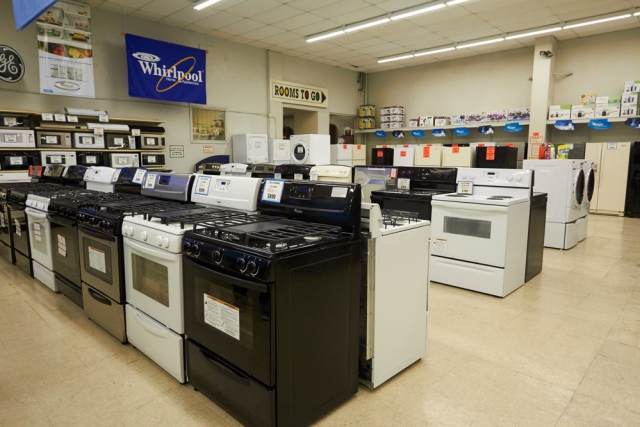
Locate an element on the screen. The width and height of the screenshot is (640, 427). drawer is located at coordinates (578, 229).